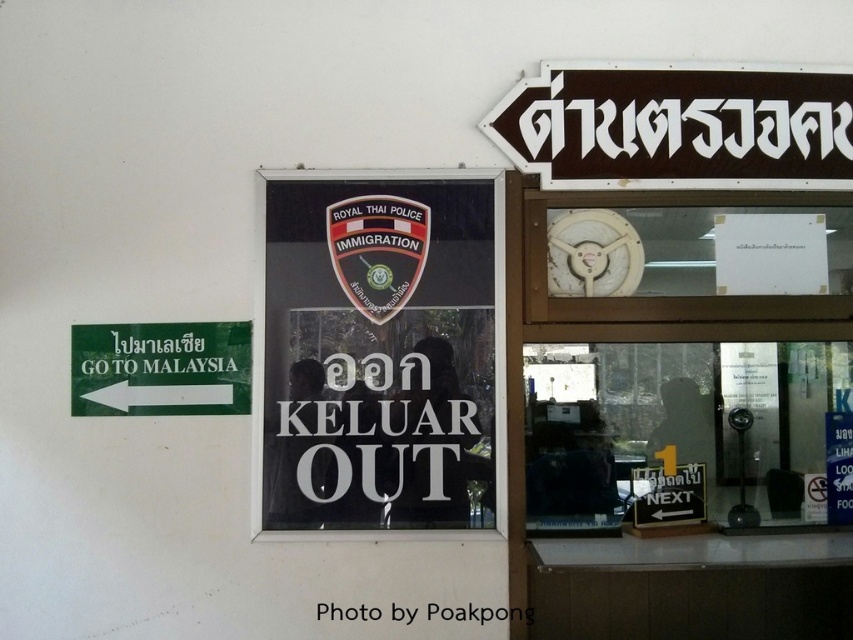
Does brownmaterial/texturesignage at upper right appear under green matte sign at left?

No, brownmaterial/texturesignage at upper right is not below green matte sign at left.

Where is `brownmaterial/texturesignage at upper right`? This screenshot has height=640, width=853. brownmaterial/texturesignage at upper right is located at coordinates (677, 128).

Identify the location of brownmaterial/texturesignage at upper right. (677, 128).

Consider the image. Can you confirm if green matte sign at left is bigger than white paper at upper center?

Indeed, green matte sign at left has a larger size compared to white paper at upper center.

Which is in front, point (165, 387) or point (390, 614)?

Point (390, 614) is in front.

The image size is (853, 640). Find the location of `green matte sign at left`. green matte sign at left is located at coordinates (160, 369).

Is the position of transparent glass sign at center less distant than that of green matte sign at left?

That is False.

Consider the image. Is transparent glass sign at center to the left of green matte sign at left from the viewer's perspective?

In fact, transparent glass sign at center is to the right of green matte sign at left.

Is point (270, 484) behind point (149, 408)?

Yes, point (270, 484) is behind point (149, 408).

This screenshot has width=853, height=640. I want to click on transparent glass sign at center, so click(x=376, y=349).